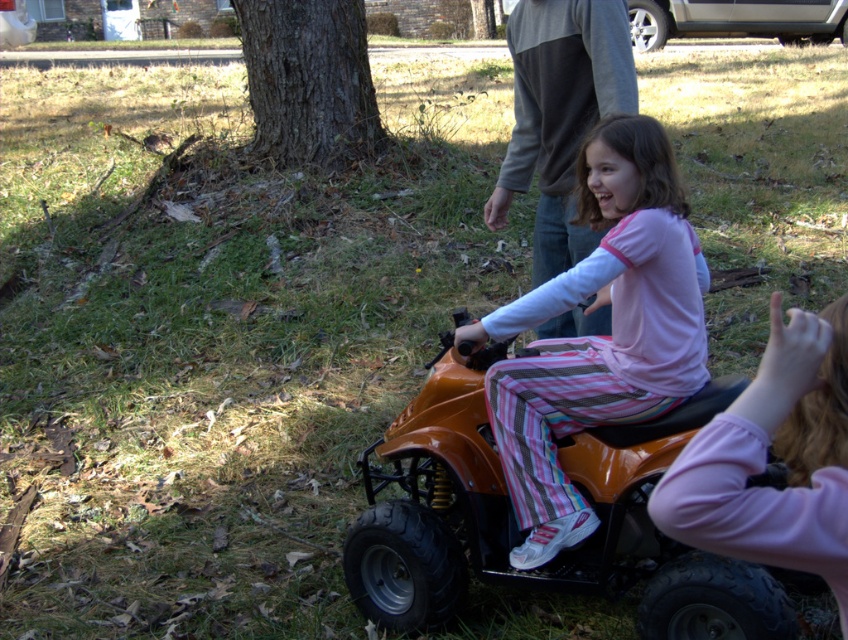
You are a parent trying to ensure safety while the children play. The matte orange quad bike at center and the gray sweater at upper center are in the scene. Which object is shorter?

The matte orange quad bike at center is shorter than the gray sweater at upper center.

You are a drone operator trying to capture a photo of the two points in the scene. The first point is at coordinates point (455, 531) and the second point is at point (699, 467). From your current position, which point will appear closer to the camera lens?

Point (455, 531) is further to the viewer than point (699, 467), so the point at (699, 467) will appear closer to the camera lens.

You are a photographer trying to capture a photo of the scene. You want to ensure both the matte orange quad bike at center and the pink fabric hand at lower right are clearly visible in the frame. Based on their positions, which object should you focus on first to ensure both are in focus?

The matte orange quad bike at center is to the left of pink fabric hand at lower right. To ensure both are in focus, you should focus on the matte orange quad bike at center first since it is closer to the camera, allowing the depth of field to cover the pink fabric hand at lower right.